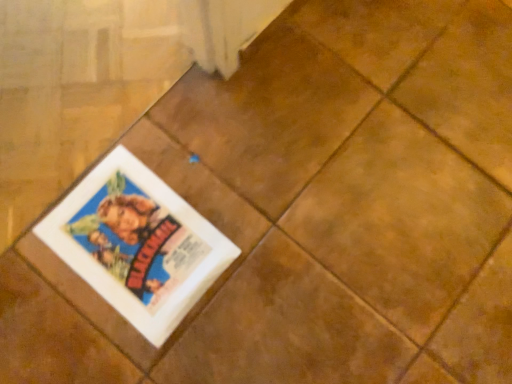
Question: Should I look upward or downward to see white paper magazine at center?

Choices:
 (A) down
 (B) up

Answer: (A)